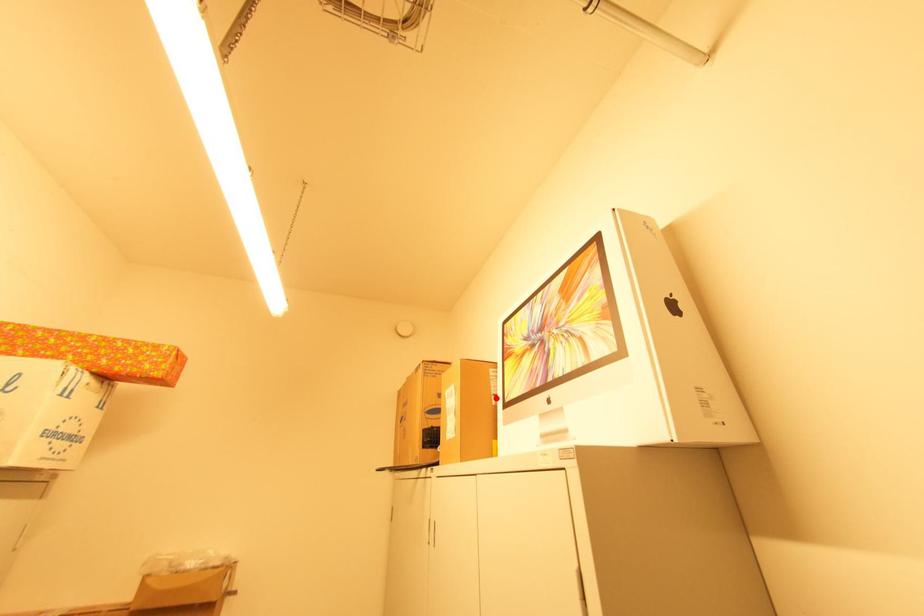
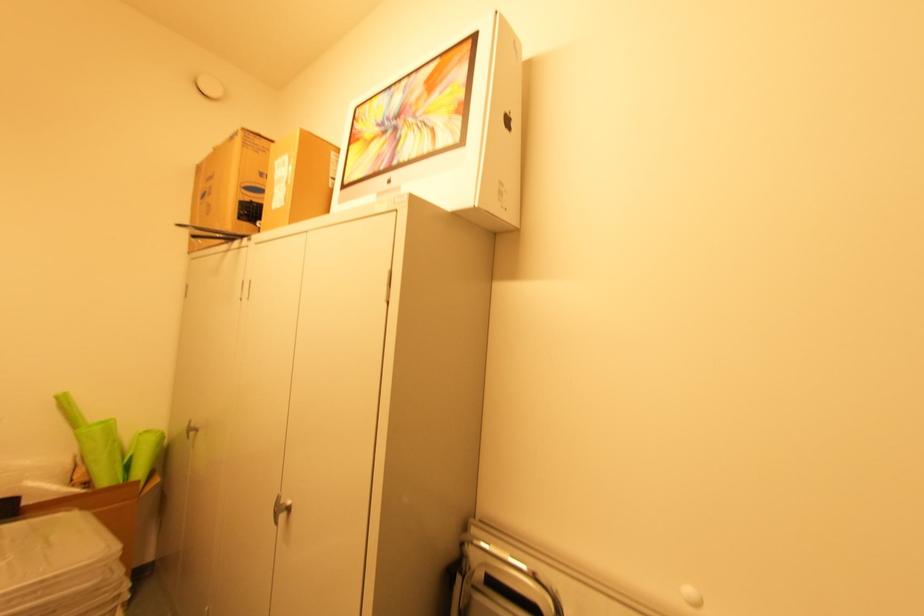
In the second image, find the point that corresponds to the highlighted location in the first image.

(334, 180)